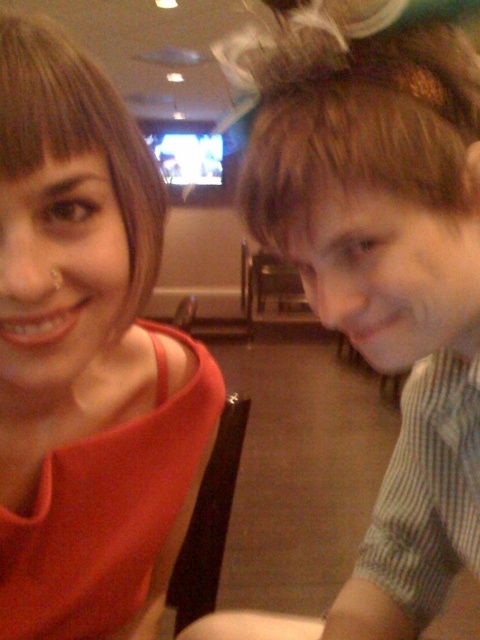
Is point (447, 364) in front of point (123, 166)?

That is False.

Does point (458, 381) lie behind point (123, 483)?

Yes.

Locate an element on the screen. This screenshot has height=640, width=480. striped cotton shirt at right is located at coordinates (376, 275).